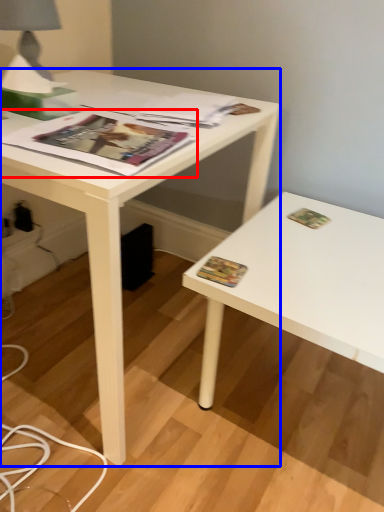
Question: Which object appears farthest to the camera in this image, magazine (highlighted by a red box) or desk (highlighted by a blue box)?

Choices:
 (A) magazine
 (B) desk

Answer: (A)